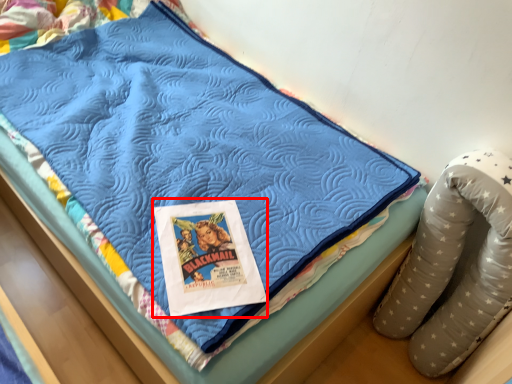
Question: In this image, where is comic book (annotated by the red box) located relative to bean bag chair?

Choices:
 (A) right
 (B) left

Answer: (B)